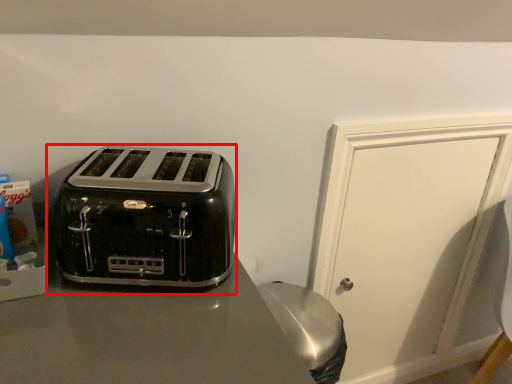
Question: From the image's perspective, what is the correct spatial relationship of toaster (annotated by the red box) in relation to door?

Choices:
 (A) above
 (B) below

Answer: (A)